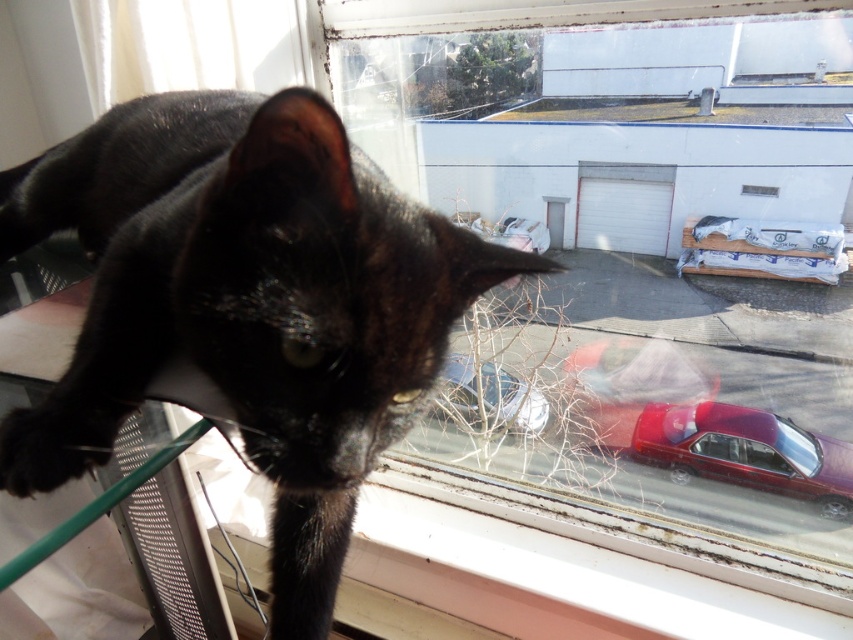
Question: Can you confirm if black glossy cat at upper left is wider than metallic silver car at lower center?

Choices:
 (A) no
 (B) yes

Answer: (B)

Question: Which point appears farthest from the camera in this image?

Choices:
 (A) [666, 452]
 (B) [51, 465]
 (C) [506, 401]
 (D) [614, 364]

Answer: (D)

Question: Does black glossy cat at upper left appear over shiny red car at lower right?

Choices:
 (A) yes
 (B) no

Answer: (A)

Question: Is shiny red car at lower right positioned behind metallic silver car at lower center?

Choices:
 (A) yes
 (B) no

Answer: (A)

Question: Among these objects, which one is nearest to the camera?

Choices:
 (A) shiny red car at lower right
 (B) metallic silver car at lower center
 (C) glossy red car at lower right

Answer: (B)

Question: Which of these objects is positioned farthest from the black glossy cat at upper left?

Choices:
 (A) metallic silver car at lower center
 (B) shiny red car at lower right

Answer: (B)